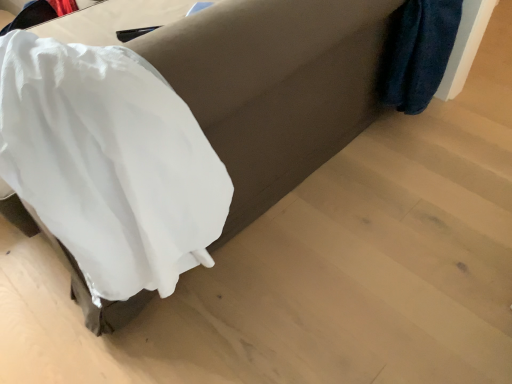
What do you see at coordinates (274, 87) in the screenshot?
I see `white fabric at lower left` at bounding box center [274, 87].

What is the approximate width of white fabric at lower left?

3.44 feet.

The width and height of the screenshot is (512, 384). What are the coordinates of `white fabric at lower left` in the screenshot? It's located at (274, 87).

At what (x,y) coordinates should I click in order to perform the action: click on white fabric at lower left. Please return your answer as a coordinate pair (x, y). Looking at the image, I should click on (109, 162).

This screenshot has height=384, width=512. What do you see at coordinates (109, 162) in the screenshot?
I see `white fabric at lower left` at bounding box center [109, 162].

What is the approximate height of white fabric at lower left?

white fabric at lower left is 22.45 inches tall.

What is the approximate width of white fabric at lower left?

35.76 centimeters.

Locate an element on the screen. white fabric at lower left is located at coordinates (274, 87).

Between white fabric at lower left and white fabric at lower left, which one appears on the left side from the viewer's perspective?

From the viewer's perspective, white fabric at lower left appears more on the left side.

Which is behind, white fabric at lower left or white fabric at lower left?

white fabric at lower left is behind.

Which point is more forward, [146,103] or [290,10]?

The point [146,103] is more forward.

From the image's perspective, would you say white fabric at lower left is positioned over white fabric at lower left?

Incorrect, from the image's perspective, white fabric at lower left is lower than white fabric at lower left.

From a real-world perspective, between white fabric at lower left and white fabric at lower left, who is vertically lower?

white fabric at lower left, from a real-world perspective.

Which object is thinner, white fabric at lower left or white fabric at lower left?

With smaller width is white fabric at lower left.

Considering the sizes of objects white fabric at lower left and white fabric at lower left in the image provided, who is shorter, white fabric at lower left or white fabric at lower left?

white fabric at lower left.

Considering the relative sizes of white fabric at lower left and white fabric at lower left in the image provided, is white fabric at lower left smaller than white fabric at lower left?

Yes.

In the scene shown: Which is correct: white fabric at lower left is inside white fabric at lower left, or outside of it?

white fabric at lower left fits inside white fabric at lower left.

Can you see white fabric at lower left touching white fabric at lower left?

A: No, white fabric at lower left is not next to white fabric at lower left.

Is white fabric at lower left oriented away from white fabric at lower left?

Yes.

How much distance is there between white fabric at lower left and white fabric at lower left?

The distance of white fabric at lower left from white fabric at lower left is 11.37 inches.

Identify the location of furniture that is on the right side of white fabric at lower left. (274, 87).

Considering the relative positions of white fabric at lower left and white fabric at lower left in the image provided, is white fabric at lower left to the left of white fabric at lower left from the viewer's perspective?

No, white fabric at lower left is not to the left of white fabric at lower left.

Which is behind, white fabric at lower left or white fabric at lower left?

white fabric at lower left is behind.

Between point (342, 141) and point (144, 210), which one is positioned in front?

The point (144, 210) is more forward.

From the image's perspective, which object appears higher, white fabric at lower left or white fabric at lower left?

From the image's view, white fabric at lower left is above.

From a real-world perspective, is white fabric at lower left positioned under white fabric at lower left based on gravity?

Yes, from a real-world perspective, white fabric at lower left is under white fabric at lower left.

Between white fabric at lower left and white fabric at lower left, which one has larger width?

white fabric at lower left.

Is white fabric at lower left shorter than white fabric at lower left?

No, white fabric at lower left is not shorter than white fabric at lower left.

Does white fabric at lower left have a smaller size compared to white fabric at lower left?

Incorrect, white fabric at lower left is not smaller in size than white fabric at lower left.

Is white fabric at lower left spatially inside white fabric at lower left, or outside of it?

white fabric at lower left exists outside the volume of white fabric at lower left.

Is white fabric at lower left far from white fabric at lower left?

white fabric at lower left is actually quite close to white fabric at lower left.

Is white fabric at lower left aimed at white fabric at lower left?

No.

How many degrees apart are the facing directions of white fabric at lower left and white fabric at lower left?

They differ by 89.2 degrees in their facing directions.

At what (x,y) coordinates should I click in order to perform the action: click on clothing above the white fabric at lower left (from a real-world perspective). Please return your answer as a coordinate pair (x, y). The image size is (512, 384). Looking at the image, I should click on (109, 162).

This screenshot has width=512, height=384. Find the location of `furniture above the white fabric at lower left (from the image's perspective)`. furniture above the white fabric at lower left (from the image's perspective) is located at coordinates (274, 87).

Where is `furniture behind the white fabric at lower left`? Image resolution: width=512 pixels, height=384 pixels. furniture behind the white fabric at lower left is located at coordinates (274, 87).